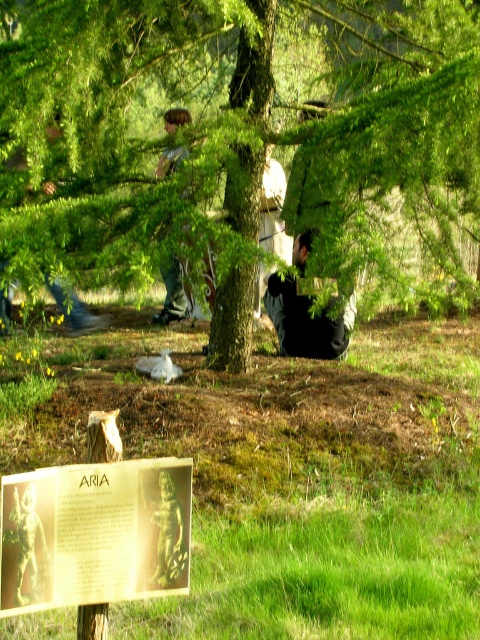
Question: Does green leafy tree at center appear over brown hair at upper center?

Choices:
 (A) no
 (B) yes

Answer: (A)

Question: Among these objects, which one is nearest to the camera?

Choices:
 (A) brown hair at upper center
 (B) black matte jacket at center
 (C) bronze statue at lower left

Answer: (C)

Question: Can you confirm if black matte jacket at center is smaller than brown hair at upper center?

Choices:
 (A) yes
 (B) no

Answer: (B)

Question: Which object is farther from the camera taking this photo?

Choices:
 (A) gold-bronze plaque at lower center
 (B) black matte jacket at center
 (C) green leafy tree at center
 (D) bronze statue at lower left

Answer: (B)

Question: Which point is farther to the camera?

Choices:
 (A) green leafy tree at center
 (B) black matte jacket at center
 (C) gold-bronze plaque at lower center

Answer: (B)

Question: Does green leafy tree at center have a larger size compared to bronze statue at lower center?

Choices:
 (A) yes
 (B) no

Answer: (A)